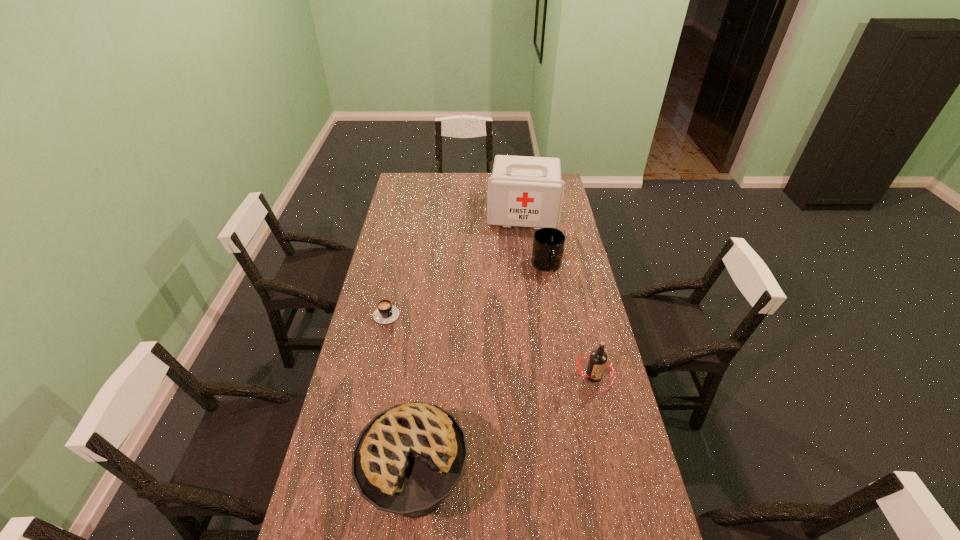
Where is `free space between the mug and the third farthest object`? The width and height of the screenshot is (960, 540). free space between the mug and the third farthest object is located at coordinates (468, 288).

The height and width of the screenshot is (540, 960). What are the coordinates of `object that is the second nearest to the pie` in the screenshot? It's located at (385, 313).

Locate which object is the second closest to the cappuccino. Please provide its 2D coordinates. Your answer should be formatted as a tuple, i.e. [(x, y)], where the tuple contains the x and y coordinates of a point satisfying the conditions above.

[(548, 244)]